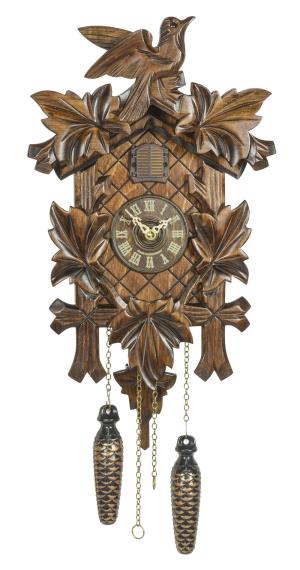
The width and height of the screenshot is (300, 570). I want to click on window, so click(x=152, y=160).